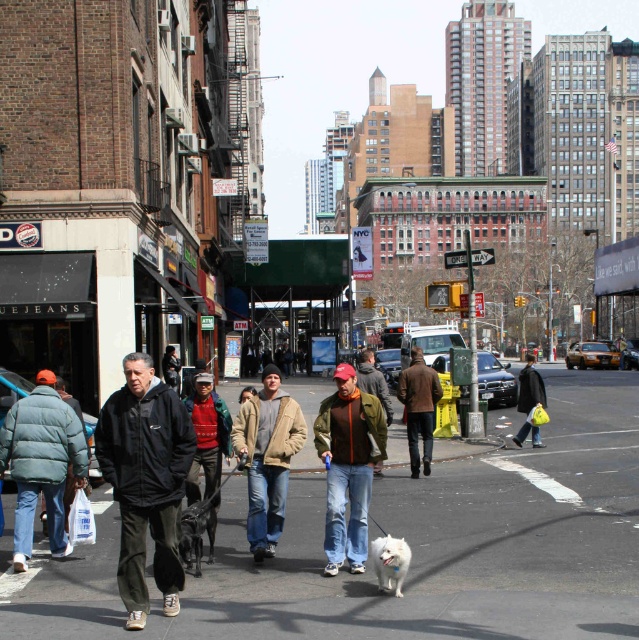
How far apart are black matte jacket at center and tan fleece jacket at center?

black matte jacket at center is 2.50 meters away from tan fleece jacket at center.

Between black matte jacket at center and tan fleece jacket at center, which one is positioned higher?

black matte jacket at center is above.

The image size is (639, 640). What are the coordinates of `black matte jacket at center` in the screenshot? It's located at (144, 481).

Locate an element on the screen. Image resolution: width=639 pixels, height=640 pixels. black matte jacket at center is located at coordinates (144, 481).

Who is higher up, brown leather jacket at center or black leather jacket at center?

black leather jacket at center

You are a GUI agent. You are given a task and a screenshot of the screen. Output one action in this format:
    pyautogui.click(x=<x>, y=<y>)
    Task: Click on the brown leather jacket at center
    This screenshot has height=640, width=639.
    Given the screenshot: What is the action you would take?
    click(x=419, y=406)

Is point (420, 362) behind point (534, 396)?

No.

Locate an element on the screen. The width and height of the screenshot is (639, 640). brown leather jacket at center is located at coordinates (419, 406).

From the picture: Does knitted sweater at center have a smaller size compared to black leather jacket at center?

Yes, knitted sweater at center is smaller than black leather jacket at center.

This screenshot has width=639, height=640. Describe the element at coordinates (206, 436) in the screenshot. I see `knitted sweater at center` at that location.

Where is `knitted sweater at center`? The height and width of the screenshot is (640, 639). knitted sweater at center is located at coordinates (206, 436).